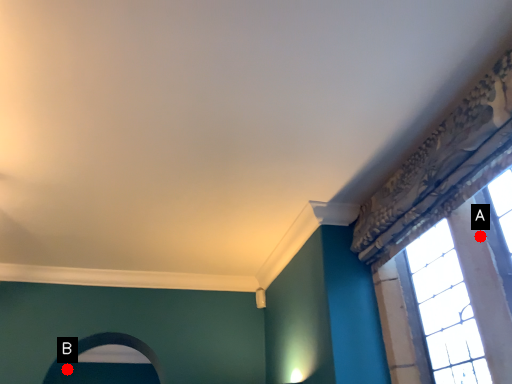
Question: Two points are circled on the image, labeled by A and B beside each circle. Which of the following is the closest to the observer?

Choices:
 (A) A is closer
 (B) B is closer

Answer: (A)